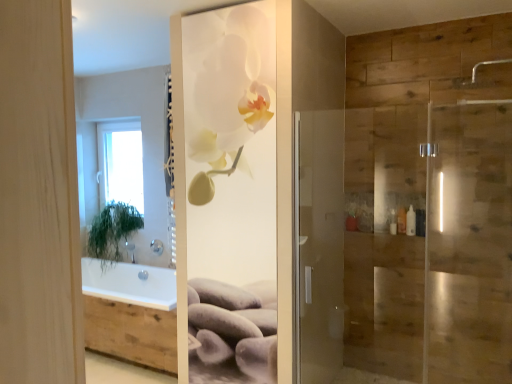
Question: In terms of width, does white plastic bottle at right look wider or thinner when compared to white glass window at upper left?

Choices:
 (A) wide
 (B) thin

Answer: (B)

Question: Considering the positions of white plastic bottle at right and white glass window at upper left in the image, is white plastic bottle at right bigger or smaller than white glass window at upper left?

Choices:
 (A) small
 (B) big

Answer: (A)

Question: Which of these objects is positioned closest to the white plastic bottle at right?

Choices:
 (A) green leafy plant at left
 (B) white glass window at upper left
 (C) white glossy orchid at center
 (D) silver metallic shower head at upper right, which is the 2th shower in back-to-front order
 (E) satin nickel showerhead at upper center, the first shower positioned from the left

Answer: (D)

Question: Which is nearer to the white plastic bottle at right?

Choices:
 (A) white glossy orchid at center
 (B) silver metallic shower head at upper right, placed as the 1th shower when sorted from top to bottom
 (C) green leafy plant at left
 (D) satin nickel showerhead at upper center, the second shower in the top-to-bottom sequence
 (E) white glass window at upper left

Answer: (B)